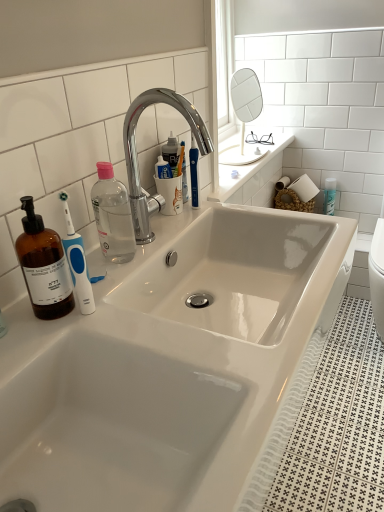
Question: Does white glossy mirror at upper center come behind chrome/metallic faucet at upper center?

Choices:
 (A) yes
 (B) no

Answer: (A)

Question: Does white glossy mirror at upper center turn towards chrome/metallic faucet at upper center?

Choices:
 (A) yes
 (B) no

Answer: (B)

Question: Can you confirm if white glossy mirror at upper center is taller than chrome/metallic faucet at upper center?

Choices:
 (A) no
 (B) yes

Answer: (B)

Question: Considering the relative sizes of white glossy mirror at upper center and chrome/metallic faucet at upper center in the image provided, is white glossy mirror at upper center wider than chrome/metallic faucet at upper center?

Choices:
 (A) yes
 (B) no

Answer: (A)

Question: Is white glossy mirror at upper center positioned with its back to chrome/metallic faucet at upper center?

Choices:
 (A) yes
 (B) no

Answer: (B)

Question: Is white glossy mirror at upper center in front of chrome/metallic faucet at upper center?

Choices:
 (A) no
 (B) yes

Answer: (A)

Question: Does chrome/metallic faucet at upper center have a greater height compared to white glossy mirror at upper center?

Choices:
 (A) no
 (B) yes

Answer: (A)

Question: Is chrome/metallic faucet at upper center wider than white glossy mirror at upper center?

Choices:
 (A) no
 (B) yes

Answer: (A)

Question: Considering the relative sizes of chrome/metallic faucet at upper center and white glossy mirror at upper center in the image provided, is chrome/metallic faucet at upper center thinner than white glossy mirror at upper center?

Choices:
 (A) yes
 (B) no

Answer: (A)

Question: From the image's perspective, would you say chrome/metallic faucet at upper center is positioned over white glossy mirror at upper center?

Choices:
 (A) yes
 (B) no

Answer: (B)

Question: Is chrome/metallic faucet at upper center in front of white glossy mirror at upper center?

Choices:
 (A) yes
 (B) no

Answer: (A)

Question: From a real-world perspective, is chrome/metallic faucet at upper center below white glossy mirror at upper center?

Choices:
 (A) yes
 (B) no

Answer: (B)

Question: From a real-world perspective, is chrome/metallic faucet at upper center physically located above or below white glossy mirror at upper center?

Choices:
 (A) below
 (B) above

Answer: (B)